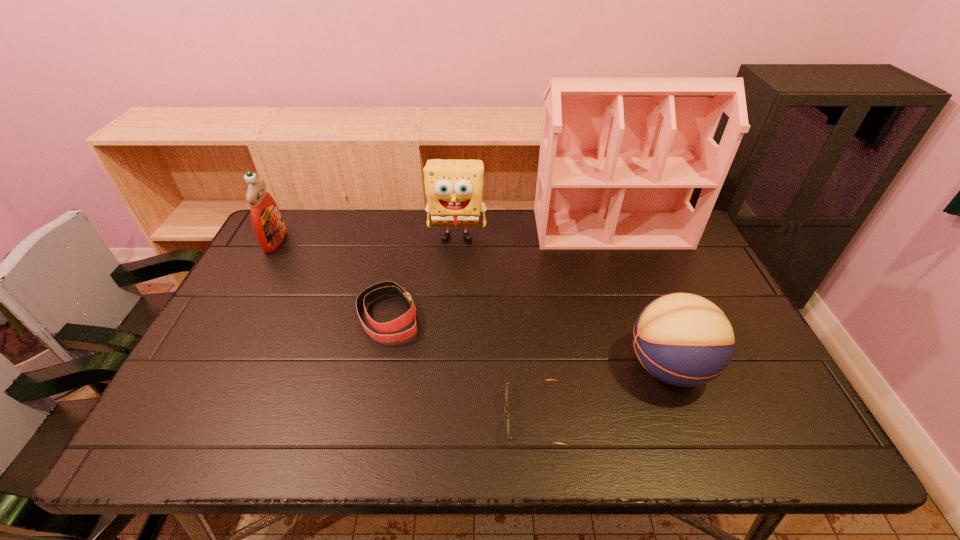
Identify the location of vacant position located 0.390m on the patterned surface of the fourth tallest object. Image resolution: width=960 pixels, height=540 pixels. (468, 367).

Locate an element on the screen. The width and height of the screenshot is (960, 540). free space located on the patterned surface of the fourth tallest object is located at coordinates (464, 367).

Identify the location of vacant space situated on the right of the dog collar. The width and height of the screenshot is (960, 540). (499, 315).

Locate an element on the screen. The image size is (960, 540). blank space located on the temples of the shortest object is located at coordinates (450, 417).

At what (x,y) coordinates should I click in order to perform the action: click on vacant space located on the temples of the shortest object. Please return your answer as a coordinate pair (x, y). The width and height of the screenshot is (960, 540). Looking at the image, I should click on (326, 417).

At what (x,y) coordinates should I click in order to perform the action: click on blank area located on the temples of the shortest object. Please return your answer as a coordinate pair (x, y). Looking at the image, I should click on (x=455, y=417).

Find the location of a particular element. dollhouse that is at the far edge is located at coordinates (619, 159).

In order to click on sponge that is at the far edge in this screenshot , I will do `click(454, 188)`.

Locate an element on the screen. This screenshot has height=540, width=960. detergent at the far edge is located at coordinates (267, 221).

Find the location of a particular element. object located at the near edge is located at coordinates (506, 391).